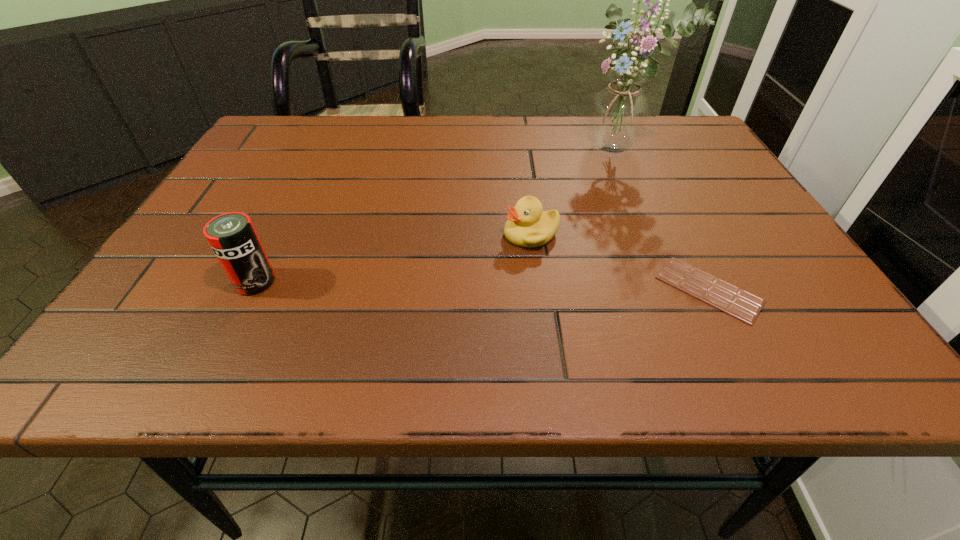
I want to click on object identified as the second closest to the third object from right to left, so click(x=618, y=117).

The image size is (960, 540). Identify the location of free space in the image that satisfies the following two spatial constraints: 1. on the front side of the chocolate bar; 2. on the left side of the duckling. (539, 289).

Image resolution: width=960 pixels, height=540 pixels. Find the location of `vacant region that satisfies the following two spatial constraints: 1. on the front side of the shortest object; 2. on the right side of the third nearest object`. vacant region that satisfies the following two spatial constraints: 1. on the front side of the shortest object; 2. on the right side of the third nearest object is located at coordinates (539, 289).

I want to click on free location that satisfies the following two spatial constraints: 1. on the back side of the farthest object; 2. on the right side of the second object from left to right, so 520,149.

What are the coordinates of `free spot that satisfies the following two spatial constraints: 1. on the front side of the bouquet; 2. on the right side of the shortest object` in the screenshot? It's located at (680, 289).

Identify the location of vacant region that satisfies the following two spatial constraints: 1. on the front side of the second farthest object; 2. on the right side of the chocolate bar. Image resolution: width=960 pixels, height=540 pixels. (539, 289).

You are a GUI agent. You are given a task and a screenshot of the screen. Output one action in this format:
    pyautogui.click(x=<x>, y=<y>)
    Task: Click on the free space in the image that satisfies the following two spatial constraints: 1. on the back side of the bouquet; 2. on the right side of the second farthest object
    The image size is (960, 540).
    Given the screenshot: What is the action you would take?
    pyautogui.click(x=520, y=149)